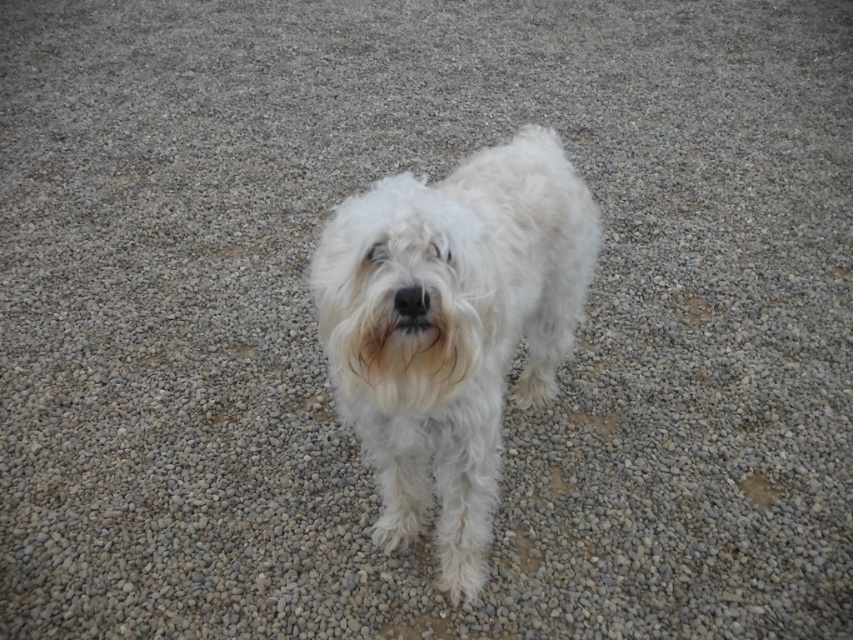
Is white fluffy dog at center smaller than black fur at center?

No.

Can you confirm if white fluffy dog at center is taller than black fur at center?

Yes.

Locate an element on the screen. white fluffy dog at center is located at coordinates (451, 328).